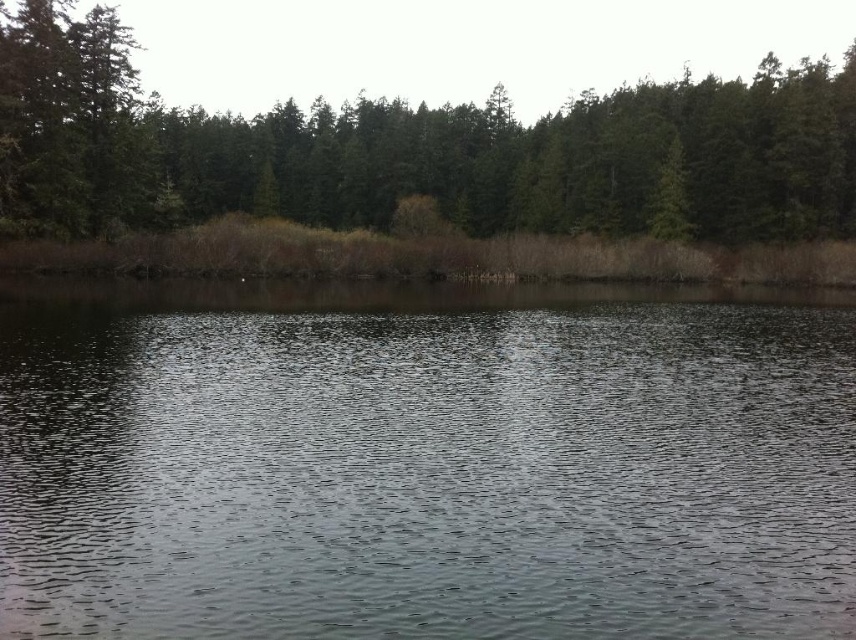
Which is in front, point (105, 403) or point (68, 120)?

Positioned in front is point (105, 403).

Who is positioned more to the left, clear water at center or green matte trees at upper center?

Positioned to the left is green matte trees at upper center.

Measure the distance between clear water at center and camera.

clear water at center is 8.45 meters away from camera.

Where is `clear water at center`? The height and width of the screenshot is (640, 856). clear water at center is located at coordinates (425, 461).